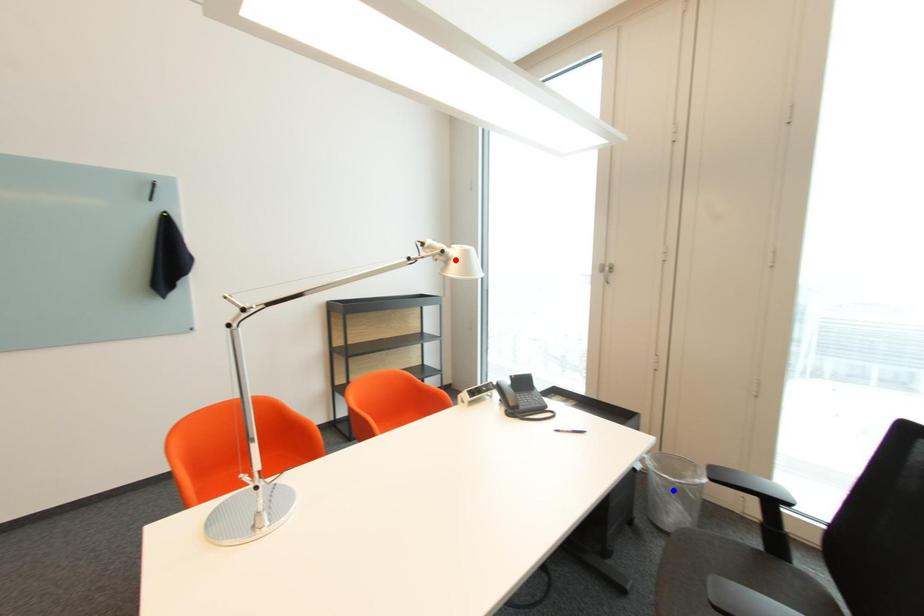
Question: Two points are marked on the image. Which point is closer to the camera?

Choices:
 (A) Blue point is closer.
 (B) Red point is closer.

Answer: (B)